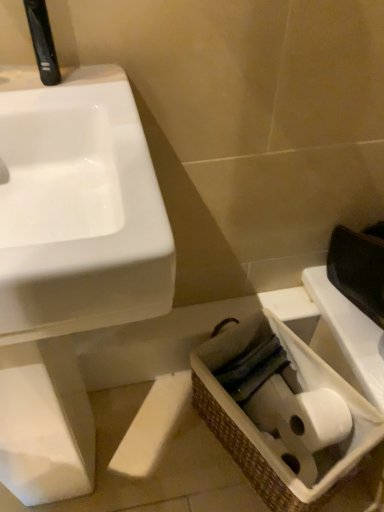
In order to click on vacant space in front of black plastic faucet at upper left in this screenshot , I will do `click(59, 111)`.